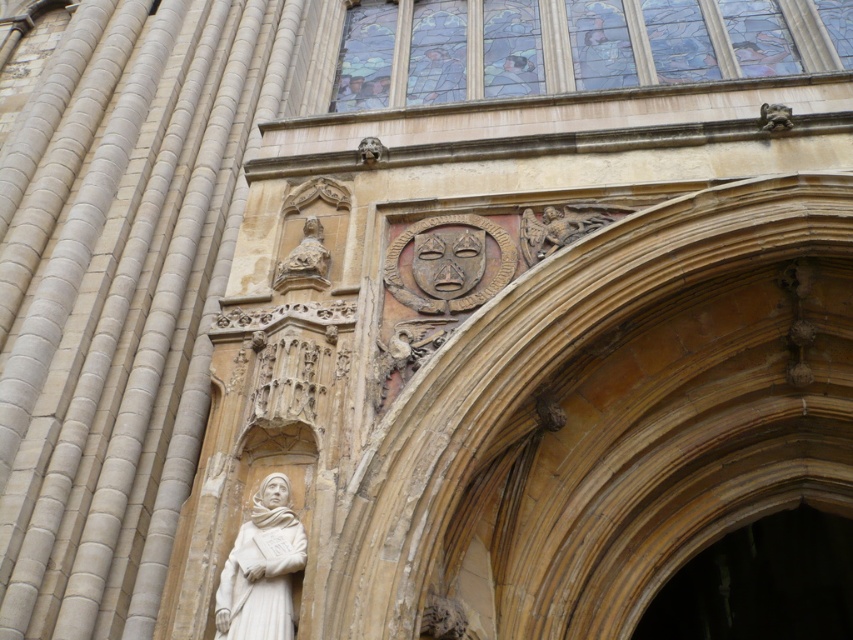
Where is `wooden archway at center`? The image size is (853, 640). wooden archway at center is located at coordinates (762, 582).

Is point (830, 580) closer to camera compared to point (244, 536)?

No, (830, 580) is behind (244, 536).

Locate an element on the screen. Image resolution: width=853 pixels, height=640 pixels. wooden archway at center is located at coordinates (762, 582).

Can you confirm if wooden archway at center is smaller than stone statue at upper center?

No, wooden archway at center is not smaller than stone statue at upper center.

Is wooden archway at center thinner than stone statue at upper center?

No.

Identify the location of wooden archway at center. The width and height of the screenshot is (853, 640). (762, 582).

Is stained glass at upper center further to the viewer compared to stone statue at upper center?

Yes.

Does stained glass at upper center have a greater width compared to stone statue at upper center?

Correct, the width of stained glass at upper center exceeds that of stone statue at upper center.

This screenshot has width=853, height=640. I want to click on stained glass at upper center, so click(553, 48).